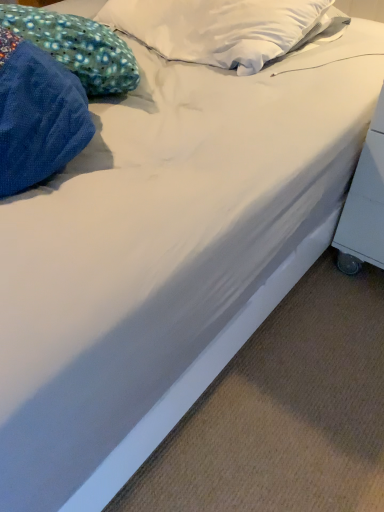
Question: Does blue dotted fabric pillow at upper left contain white plastic table at lower right?

Choices:
 (A) yes
 (B) no

Answer: (B)

Question: Could you tell me if blue dotted fabric pillow at upper left is turned towards white plastic table at lower right?

Choices:
 (A) no
 (B) yes

Answer: (A)

Question: Is blue dotted fabric pillow at upper left smaller than white plastic table at lower right?

Choices:
 (A) yes
 (B) no

Answer: (B)

Question: Can you confirm if blue dotted fabric pillow at upper left is wider than white plastic table at lower right?

Choices:
 (A) no
 (B) yes

Answer: (A)

Question: From the image's perspective, is blue dotted fabric pillow at upper left over white plastic table at lower right?

Choices:
 (A) no
 (B) yes

Answer: (B)

Question: From the image's perspective, is blue dotted fabric pillow at upper left located beneath white plastic table at lower right?

Choices:
 (A) yes
 (B) no

Answer: (B)

Question: Is white plastic table at lower right facing away from blue dotted fabric pillow at upper left?

Choices:
 (A) no
 (B) yes

Answer: (A)

Question: From the image's perspective, is white plastic table at lower right located beneath blue dotted fabric pillow at upper left?

Choices:
 (A) yes
 (B) no

Answer: (A)

Question: Does white plastic table at lower right have a larger size compared to blue dotted fabric pillow at upper left?

Choices:
 (A) no
 (B) yes

Answer: (A)

Question: Is the depth of white plastic table at lower right greater than that of blue dotted fabric pillow at upper left?

Choices:
 (A) no
 (B) yes

Answer: (A)

Question: Could you tell me if white plastic table at lower right is turned towards blue dotted fabric pillow at upper left?

Choices:
 (A) yes
 (B) no

Answer: (B)

Question: Can you confirm if white plastic table at lower right is positioned to the right of blue dotted fabric pillow at upper left?

Choices:
 (A) yes
 (B) no

Answer: (A)

Question: Considering their positions, is blue dotted fabric pillow at upper left located in front of or behind white plastic table at lower right?

Choices:
 (A) behind
 (B) front

Answer: (A)